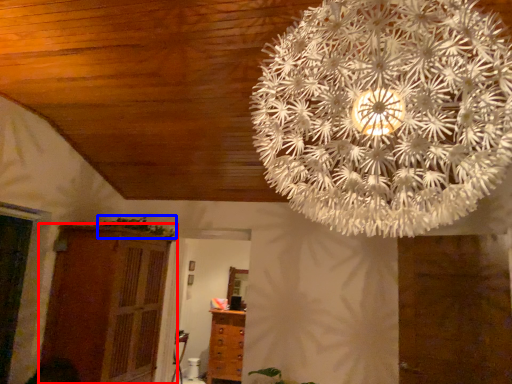
Question: Which object is further to the camera taking this photo, cupboard (highlighted by a red box) or plant (highlighted by a blue box)?

Choices:
 (A) cupboard
 (B) plant

Answer: (B)